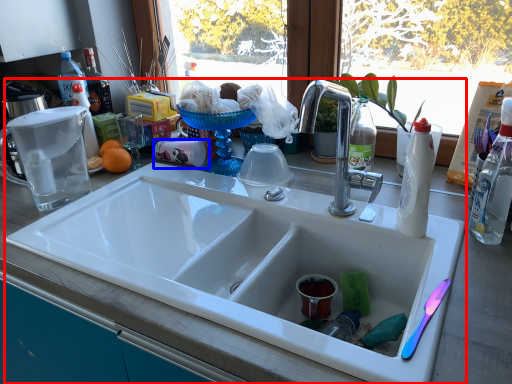
Question: Which point is closer to the camera, sink (highlighted by a red box) or coffee cup (highlighted by a blue box)?

Choices:
 (A) sink
 (B) coffee cup

Answer: (A)